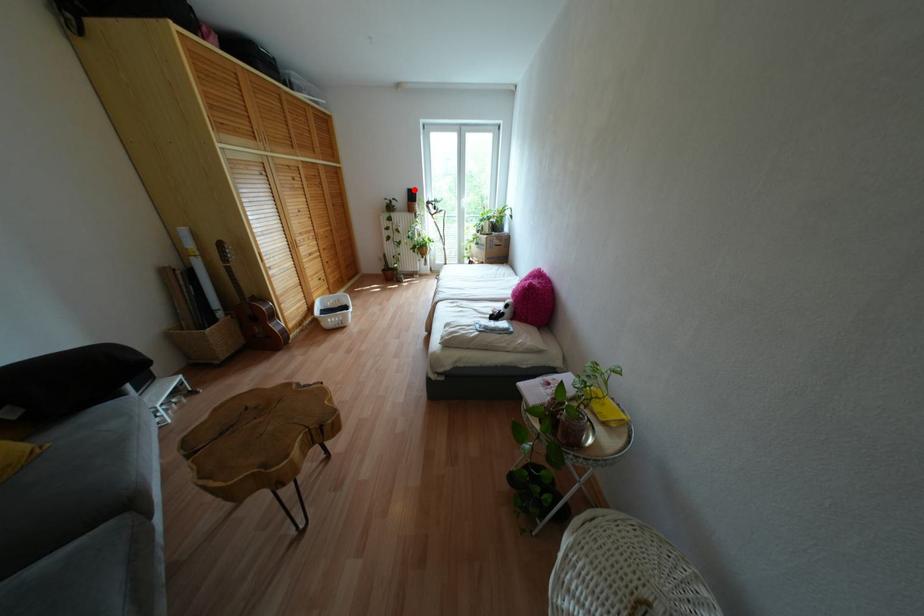
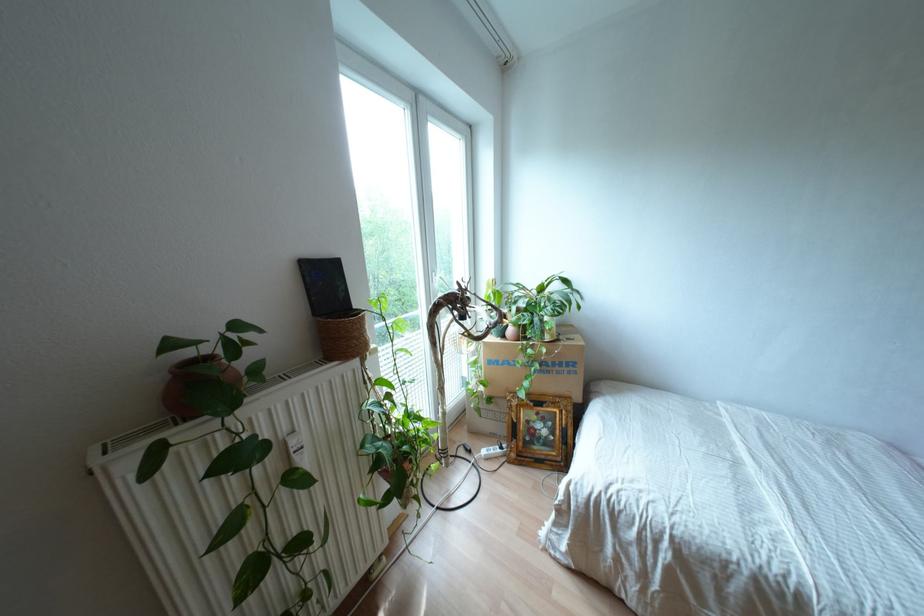
Question: I am providing you with two images of the same scene from different viewpoints. A red point is shown in image1. For the corresponding object point in image2, is it positioned nearer or farther from the camera?

Choices:
 (A) Nearer
 (B) Farther

Answer: (B)